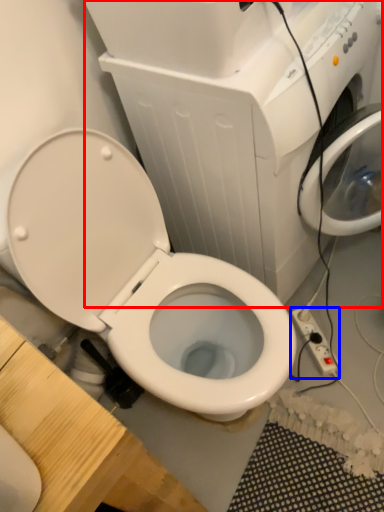
Question: Which point is further to the camera, appliance (highlighted by a red box) or electric outlet (highlighted by a blue box)?

Choices:
 (A) appliance
 (B) electric outlet

Answer: (B)